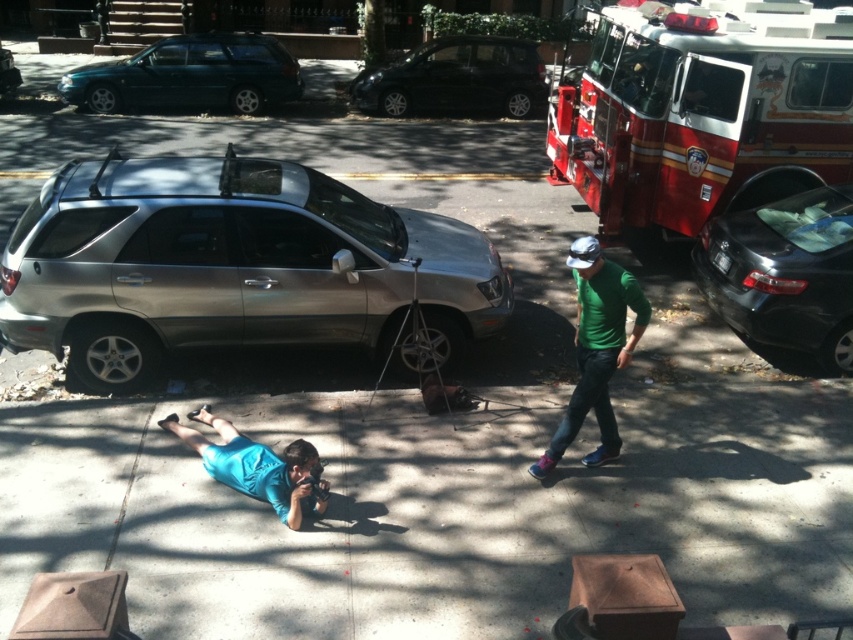
Question: Does satin silver suv at left have a larger size compared to green matte shirt at center-right?

Choices:
 (A) yes
 (B) no

Answer: (A)

Question: Which object is positioned farthest from the black matte car at right?

Choices:
 (A) red metallic fire truck at upper right
 (B) shiny black car at center
 (C) satin silver suv at left

Answer: (B)

Question: Can you confirm if red metallic fire truck at upper right is smaller than shiny black car at center?

Choices:
 (A) yes
 (B) no

Answer: (B)

Question: Which point is farther to the camera?

Choices:
 (A) (639, 308)
 (B) (486, 54)
 (C) (218, 77)
 (D) (805, 305)

Answer: (B)

Question: Does red metallic fire truck at upper right have a smaller size compared to shiny black car at center?

Choices:
 (A) yes
 (B) no

Answer: (B)

Question: Which of these objects is positioned closest to the metallic silver suv at center?

Choices:
 (A) satin silver suv at left
 (B) red metallic fire truck at upper right

Answer: (A)